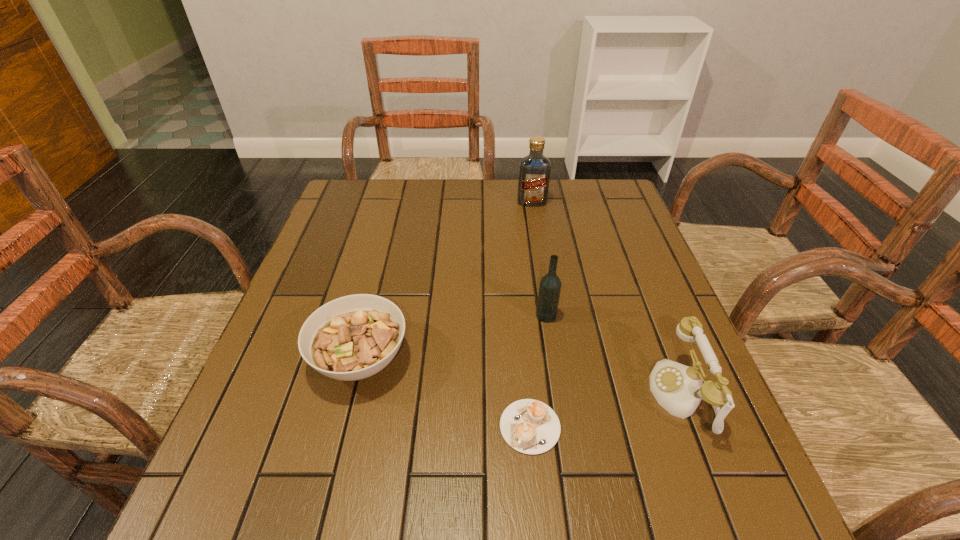
Where is `free spot located on the right of the second tallest object`? free spot located on the right of the second tallest object is located at coordinates (578, 315).

Where is `free location located 0.070m on the dial of the third tallest object`? free location located 0.070m on the dial of the third tallest object is located at coordinates (615, 395).

This screenshot has width=960, height=540. Identify the location of free location located on the dial of the third tallest object. (584, 395).

You are a GUI agent. You are given a task and a screenshot of the screen. Output one action in this format:
    pyautogui.click(x=<x>, y=<y>)
    Task: Click on the vacant point located on the dial of the third tallest object
    Image resolution: width=960 pixels, height=540 pixels.
    Given the screenshot: What is the action you would take?
    pyautogui.click(x=594, y=395)

This screenshot has height=540, width=960. I want to click on free space located on the front of the leftmost object, so click(x=319, y=529).

Where is `vacant space located on the left of the cappuccino`? This screenshot has width=960, height=540. vacant space located on the left of the cappuccino is located at coordinates (422, 427).

Where is `object located at the far edge`? This screenshot has height=540, width=960. object located at the far edge is located at coordinates (534, 170).

Where is `object present at the left edge`? object present at the left edge is located at coordinates (353, 337).

Locate an element on the screen. This screenshot has height=540, width=960. object situated at the right edge is located at coordinates (679, 389).

Locate an element on the screen. Image resolution: width=960 pixels, height=540 pixels. vacant space at the far edge of the desktop is located at coordinates (572, 218).